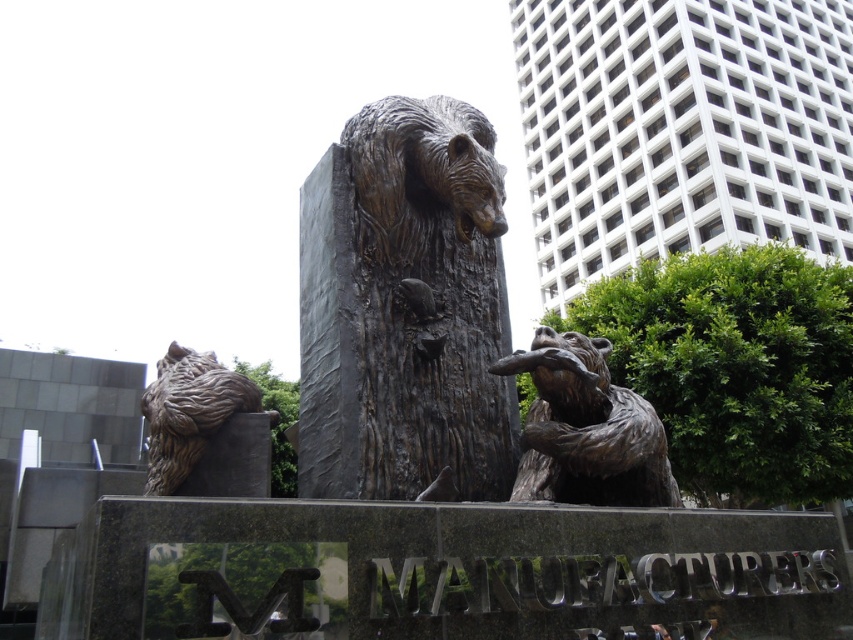
Is point (550, 444) less distant than point (276, 467)?

Yes, point (550, 444) is closer to viewer.

Is bronze bear at lower right shorter than bronze textured tree at center?

Yes, bronze bear at lower right is shorter than bronze textured tree at center.

The width and height of the screenshot is (853, 640). I want to click on bronze bear at lower right, so click(x=585, y=428).

Where is `bronze bear at lower right`? The image size is (853, 640). bronze bear at lower right is located at coordinates (585, 428).

Does point (758, 280) come farther from viewer compared to point (283, 444)?

No, it is in front of (283, 444).

Does point (625, 369) lie in front of point (283, 476)?

Yes, it is.

Where is `green leafy tree at lower right`? green leafy tree at lower right is located at coordinates (735, 368).

Can you confirm if bronze textured bear at center is smaller than bronze textured tree at center?

Correct, bronze textured bear at center occupies less space than bronze textured tree at center.

Can you confirm if bronze textured bear at center is positioned below bronze textured tree at center?

Incorrect, bronze textured bear at center is not positioned below bronze textured tree at center.

Is point (322, 449) more distant than point (271, 387)?

No.

Where is `bronze textured bear at center`? The height and width of the screenshot is (640, 853). bronze textured bear at center is located at coordinates (404, 307).